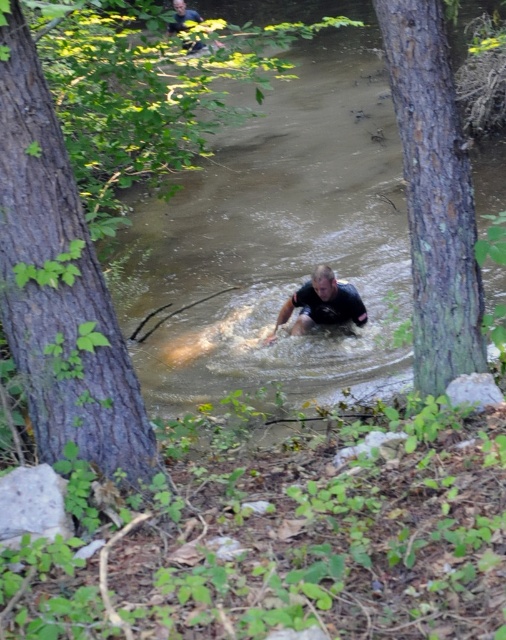
Question: Which of the following is the closest to the observer?

Choices:
 (A) (437, 172)
 (B) (3, 237)

Answer: (B)

Question: Can you confirm if brown rough tree trunk at center-left is positioned above green rough bark tree at center?

Choices:
 (A) no
 (B) yes

Answer: (A)

Question: Is brown rough tree trunk at center-left closer to camera compared to black matte shirt at center?

Choices:
 (A) yes
 (B) no

Answer: (A)

Question: Which of these objects is positioned closest to the brown rough tree trunk at center-left?

Choices:
 (A) green rough bark tree at center
 (B) black matte shirt at center

Answer: (A)

Question: From the image, what is the correct spatial relationship of brown rough tree trunk at center-left in relation to green rough bark tree at center?

Choices:
 (A) right
 (B) left

Answer: (B)

Question: Considering the real-world distances, which object is closest to the green rough bark tree at center?

Choices:
 (A) brown rough tree trunk at center-left
 (B) black matte shirt at center

Answer: (A)